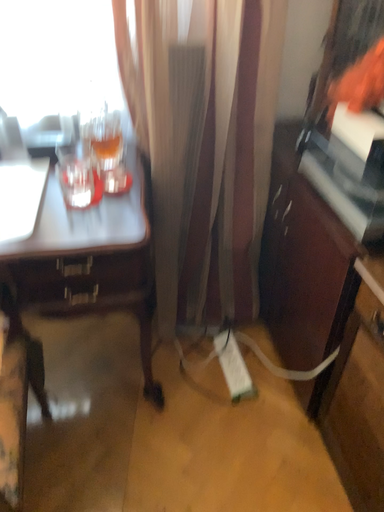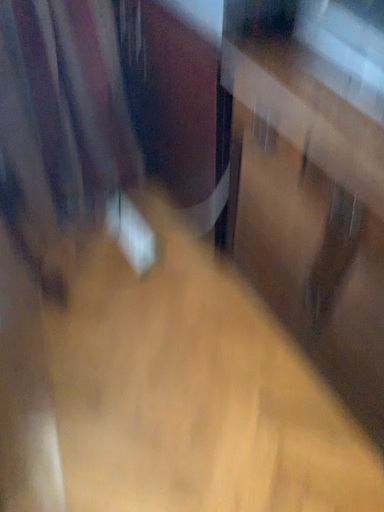
Question: Which way did the camera rotate in the video?

Choices:
 (A) rotated left
 (B) rotated right

Answer: (B)